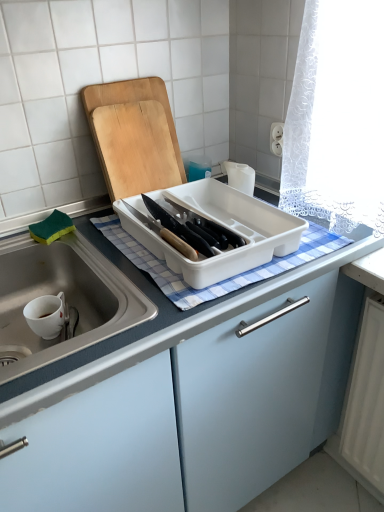
Question: In terms of width, does blue checkered cloth at center look wider or thinner when compared to white plastic tray at center?

Choices:
 (A) wide
 (B) thin

Answer: (A)

Question: Which is correct: blue checkered cloth at center is inside white plastic tray at center, or outside of it?

Choices:
 (A) outside
 (B) inside

Answer: (B)

Question: Which object is positioned farthest from the blue checkered cloth at center?

Choices:
 (A) white plastic tray at center
 (B) wooden cutting board at upper center

Answer: (B)

Question: Based on their relative distances, which object is farther from the blue checkered cloth at center?

Choices:
 (A) white plastic tray at center
 (B) wooden cutting board at upper center

Answer: (B)